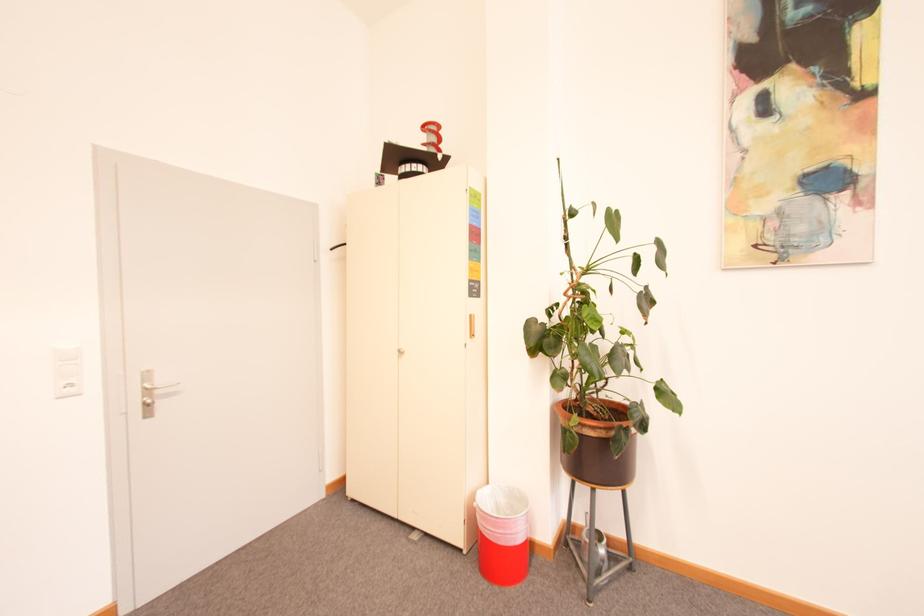
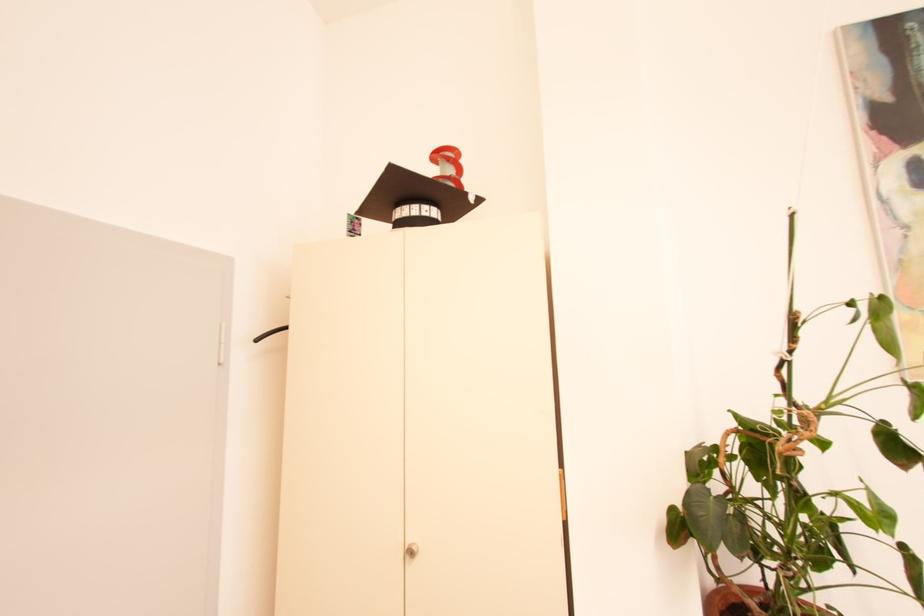
Locate, in the second image, the point that corresponds to the point at 446,158 in the first image.

(478, 199)